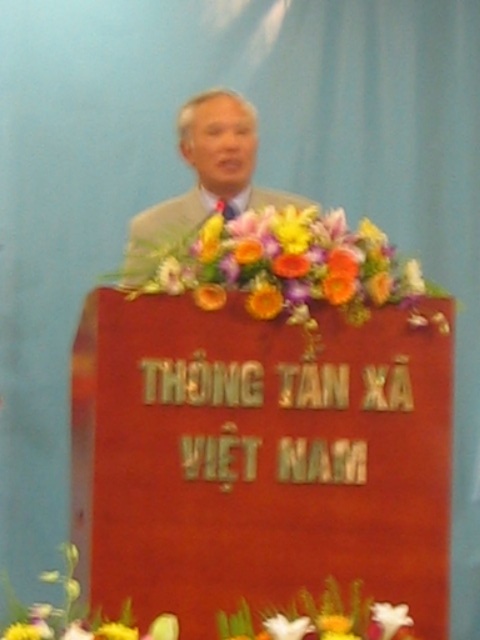
Who is more forward, (201,428) or (144,234)?

Point (201,428) is more forward.

This screenshot has width=480, height=640. I want to click on red wood sign at center, so click(267, 460).

Who is lower down, red wood sign at center or vibrant bouquet at center?

red wood sign at center is below.

Between red wood sign at center and vibrant bouquet at center, which one appears on the left side from the viewer's perspective?

Positioned to the left is red wood sign at center.

What do you see at coordinates (267, 460) in the screenshot? I see `red wood sign at center` at bounding box center [267, 460].

Find the location of a particular element. red wood sign at center is located at coordinates (267, 460).

Based on the photo, can you confirm if vibrant bouquet at center is positioned below light gray suit at center?

Correct, vibrant bouquet at center is located below light gray suit at center.

Is point (330, 232) farther from viewer compared to point (214, 141)?

No, it is not.

Who is more forward, (298,230) or (215,134)?

Positioned in front is point (298,230).

The image size is (480, 640). I want to click on vibrant bouquet at center, so click(x=288, y=262).